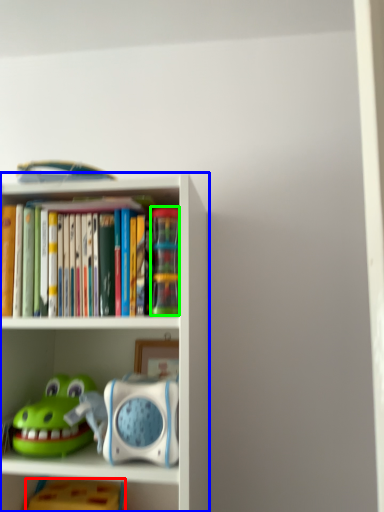
Question: Considering the real-world distances, which object is farthest from toy (highlighted by a red box)? shelf (highlighted by a blue box) or toy (highlighted by a green box)?

Choices:
 (A) shelf
 (B) toy

Answer: (B)